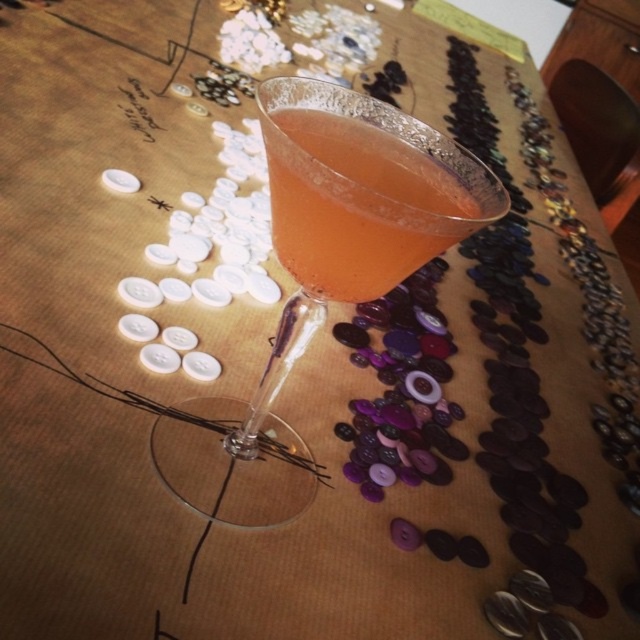
Does transparent glass cocktail at center appear on the right side of translucent glass at center?

No, transparent glass cocktail at center is not to the right of translucent glass at center.

Is point (314, 80) positioned after point (348, 141)?

Yes, point (314, 80) is farther from viewer.

Based on the photo, who is more distant from viewer, (272, 369) or (433, 189)?

Point (272, 369)

Find the location of a particular element. The image size is (640, 640). transparent glass cocktail at center is located at coordinates (314, 291).